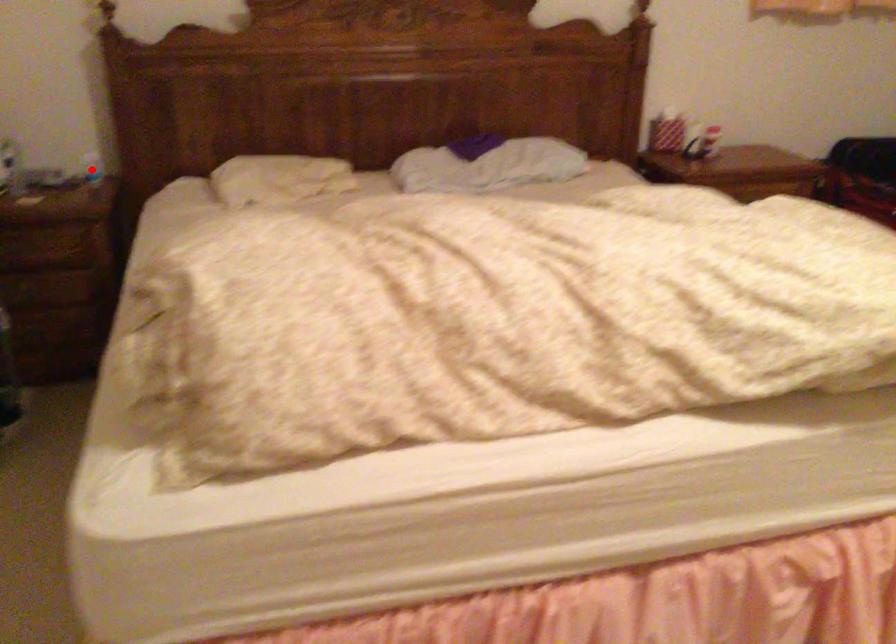
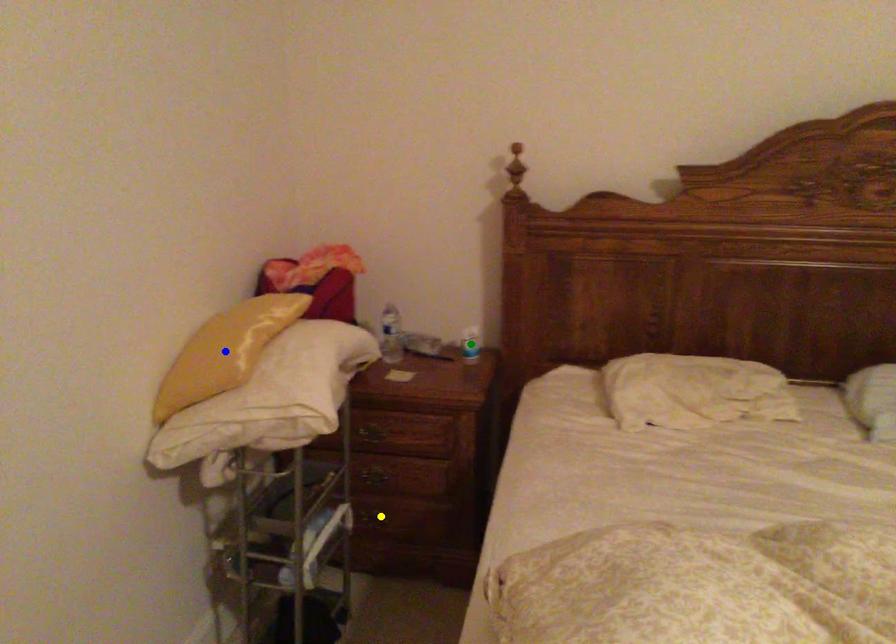
Question: I am providing you with two images of the same scene from different viewpoints. A red point is marked on the first image. You are given multiple points on the second image. Can you choose the point in image 2 that corresponds to the point in image 1?

Choices:
 (A) green point
 (B) blue point
 (C) yellow point

Answer: (A)